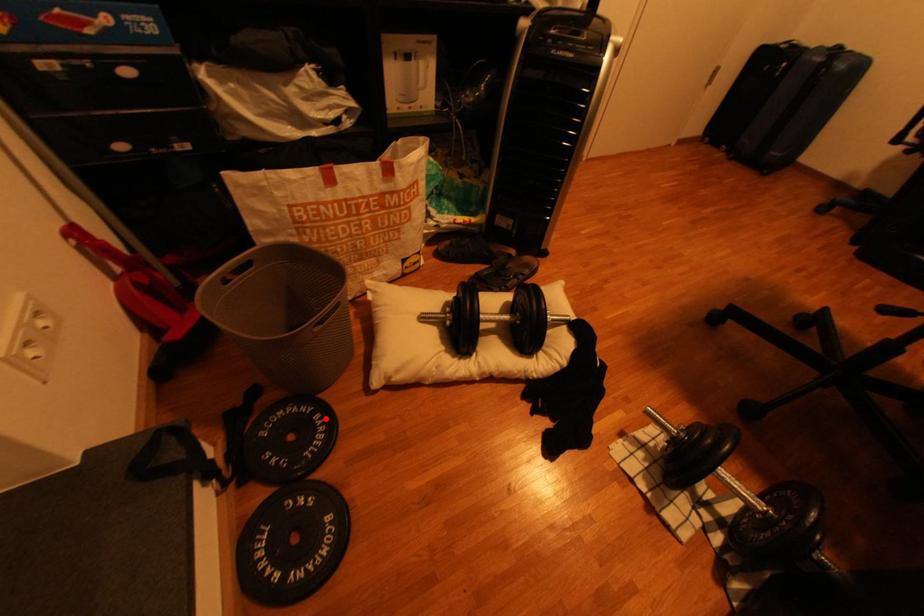
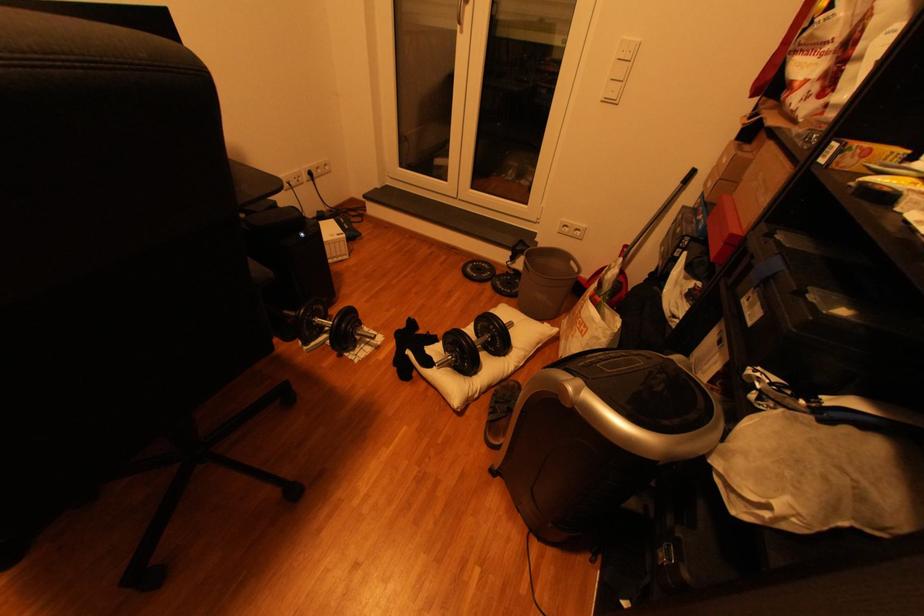
The point at the highlighted location is marked in the first image. Where is the corresponding point in the second image?

(518, 292)